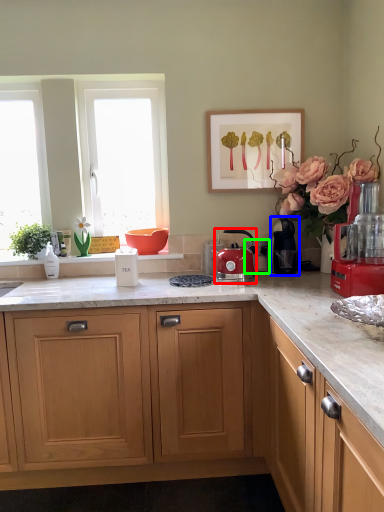
Question: Which object is the farthest from kitchen appliance (highlighted by a red box)? Choose among these: coffee machine (highlighted by a blue box) or coffee machine (highlighted by a green box).

Choices:
 (A) coffee machine
 (B) coffee machine

Answer: (B)